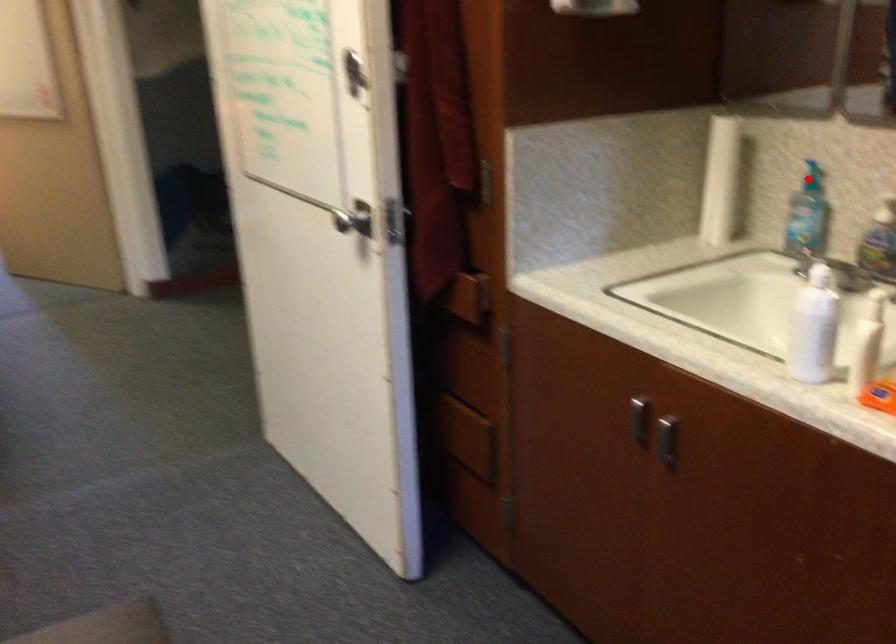
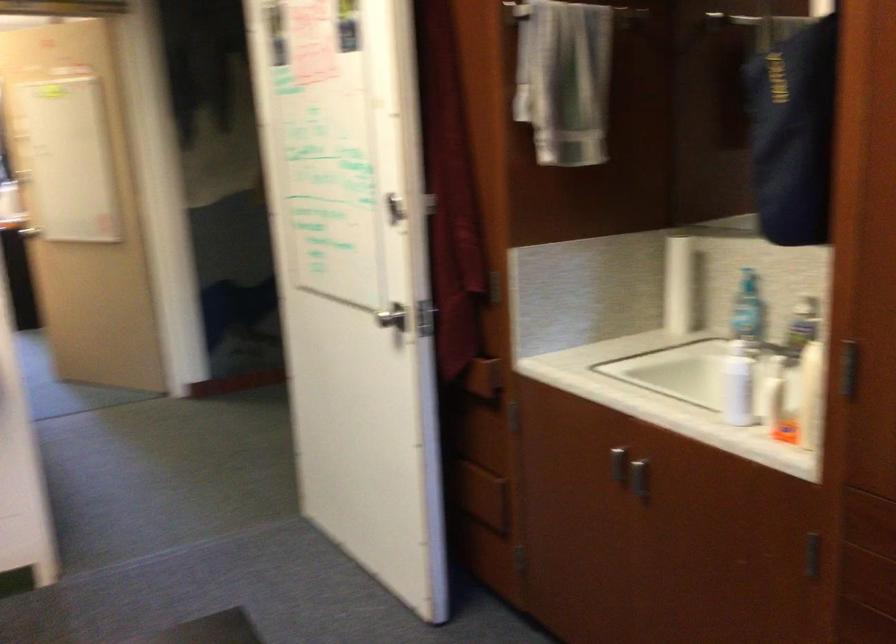
Question: I am providing you with two images of the same scene from different viewpoints. A red point is marked on the first image. Can you still see the location of the red point in image 2?

Choices:
 (A) Yes
 (B) No

Answer: (A)